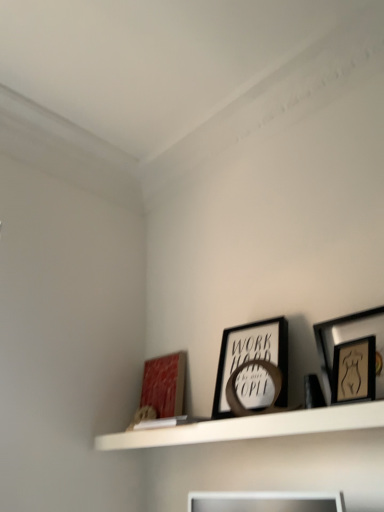
At what (x,y) coordinates should I click in order to perform the action: click on wooden framed artwork at upper right, which ranks as the 3th picture frame in left-to-right order. Please return your answer as a coordinate pair (x, y). This screenshot has width=384, height=512. Looking at the image, I should click on (352, 340).

The image size is (384, 512). What do you see at coordinates (251, 357) in the screenshot?
I see `black matte picture frame at center, which is the second picture frame from front to back` at bounding box center [251, 357].

You are a GUI agent. You are given a task and a screenshot of the screen. Output one action in this format:
    pyautogui.click(x=<x>, y=<y>)
    Task: Click on the wooden framed artwork at upper right, which ranks as the 3th picture frame in left-to-right order
    The height and width of the screenshot is (512, 384).
    Given the screenshot: What is the action you would take?
    pyautogui.click(x=352, y=340)

Is matte red picture frame at lower left, placed as the 3th picture frame when sorted from right to left, to the left or to the right of black matte picture frame at center, which is the second picture frame from front to back, in the image?

Based on their positions, matte red picture frame at lower left, placed as the 3th picture frame when sorted from right to left, is located to the left of black matte picture frame at center, which is the second picture frame from front to back.

From a real-world perspective, between matte red picture frame at lower left, the first picture frame viewed from the left, and black matte picture frame at center, which is the second picture frame from front to back, who is vertically lower?

From a 3D spatial view, matte red picture frame at lower left, the first picture frame viewed from the left, is below.

Can you see matte red picture frame at lower left, the first picture frame positioned from the back, touching black matte picture frame at center, which is the 2th picture frame in back-to-front order?

No, matte red picture frame at lower left, the first picture frame positioned from the back, is not in contact with black matte picture frame at center, which is the 2th picture frame in back-to-front order.

Consider the image. Is matte red picture frame at lower left, the third picture frame viewed from the front, facing away from black matte picture frame at center, the second picture frame when ordered from right to left?

No, matte red picture frame at lower left, the third picture frame viewed from the front, is not facing away from black matte picture frame at center, the second picture frame when ordered from right to left.

Is white matte shelf at upper center far from matte red picture frame at lower left, placed as the 3th picture frame when sorted from right to left?

No, white matte shelf at upper center is not far from matte red picture frame at lower left, placed as the 3th picture frame when sorted from right to left.

From a real-world perspective, which object stands above the other?

matte red picture frame at lower left, placed as the 3th picture frame when sorted from right to left, is physically above.

Which of these two, white matte shelf at upper center or matte red picture frame at lower left, the first picture frame positioned from the back, is wider?

white matte shelf at upper center.

From the picture: Is black matte picture frame at center, which is the second picture frame from front to back, shorter than matte red picture frame at lower left, the first picture frame positioned from the back?

No.

In the scene shown: From a real-world perspective, does black matte picture frame at center, which is the 2th picture frame in back-to-front order, sit lower than matte red picture frame at lower left, the third picture frame viewed from the front?

No, from a real-world perspective, black matte picture frame at center, which is the 2th picture frame in back-to-front order, is not beneath matte red picture frame at lower left, the third picture frame viewed from the front.

Starting from the matte red picture frame at lower left, the third picture frame viewed from the front, which picture frame is the 1st one to the right? Please provide its 2D coordinates.

[(251, 357)]

Measure the distance between black matte picture frame at center, which is the 2th picture frame in back-to-front order, and matte red picture frame at lower left, the first picture frame viewed from the left.

The distance of black matte picture frame at center, which is the 2th picture frame in back-to-front order, from matte red picture frame at lower left, the first picture frame viewed from the left, is 15.96 inches.

Does point (333, 350) come behind point (373, 401)?

That is True.

Consider the image. Measure the distance between wooden framed artwork at upper right, marked as the first picture frame in a right-to-left arrangement, and white matte shelf at upper center.

They are 12.31 inches apart.

From the image's perspective, which one is positioned lower, wooden framed artwork at upper right, which ranks as the first picture frame in front-to-back order, or white matte shelf at upper center?

white matte shelf at upper center.

Does matte red picture frame at lower left, the first picture frame viewed from the left, have a smaller size compared to wooden framed artwork at upper right, which ranks as the 3th picture frame in left-to-right order?

Yes, matte red picture frame at lower left, the first picture frame viewed from the left, is smaller than wooden framed artwork at upper right, which ranks as the 3th picture frame in left-to-right order.

Is matte red picture frame at lower left, the first picture frame positioned from the back, facing towards wooden framed artwork at upper right, which ranks as the first picture frame in front-to-back order?

No, matte red picture frame at lower left, the first picture frame positioned from the back, is not facing towards wooden framed artwork at upper right, which ranks as the first picture frame in front-to-back order.

From the image's perspective, between matte red picture frame at lower left, the first picture frame positioned from the back, and wooden framed artwork at upper right, which ranks as the 3th picture frame in left-to-right order, which one is located above?

wooden framed artwork at upper right, which ranks as the 3th picture frame in left-to-right order.

Is matte red picture frame at lower left, placed as the 3th picture frame when sorted from right to left, not close to wooden framed artwork at upper right, which ranks as the 3th picture frame in left-to-right order?

matte red picture frame at lower left, placed as the 3th picture frame when sorted from right to left, is near wooden framed artwork at upper right, which ranks as the 3th picture frame in left-to-right order, not far away.

Which object is further away from the camera, white matte shelf at upper center or black matte picture frame at center, marked as the second picture frame in a left-to-right arrangement?

black matte picture frame at center, marked as the second picture frame in a left-to-right arrangement, is further away from the camera.

Is white matte shelf at upper center thinner than black matte picture frame at center, which is the second picture frame from front to back?

Incorrect, the width of white matte shelf at upper center is not less than that of black matte picture frame at center, which is the second picture frame from front to back.

Is white matte shelf at upper center next to black matte picture frame at center, marked as the second picture frame in a left-to-right arrangement?

white matte shelf at upper center is not next to black matte picture frame at center, marked as the second picture frame in a left-to-right arrangement, and they're not touching.

From a real-world perspective, which object rests below the other?

From a 3D spatial view, white matte shelf at upper center is below.

Would you say matte red picture frame at lower left, the first picture frame viewed from the left, is outside white matte shelf at upper center?

matte red picture frame at lower left, the first picture frame viewed from the left, is positioned outside white matte shelf at upper center.

Is there a large distance between matte red picture frame at lower left, the first picture frame viewed from the left, and white matte shelf at upper center?

Actually, matte red picture frame at lower left, the first picture frame viewed from the left, and white matte shelf at upper center are a little close together.

The width and height of the screenshot is (384, 512). What are the coordinates of `picture frame located on the left of white matte shelf at upper center` in the screenshot? It's located at (164, 384).

Does matte red picture frame at lower left, the first picture frame positioned from the back, turn towards white matte shelf at upper center?

No, matte red picture frame at lower left, the first picture frame positioned from the back, is not oriented towards white matte shelf at upper center.

Find the location of a particular element. The width and height of the screenshot is (384, 512). picture frame below the black matte picture frame at center, which is the 2th picture frame in back-to-front order (from the image's perspective) is located at coordinates (164, 384).

Identify the location of shelf lying in front of the matte red picture frame at lower left, the first picture frame positioned from the back. (252, 426).

Based on their spatial positions, is white matte shelf at upper center or matte red picture frame at lower left, the first picture frame positioned from the back, closer to wooden framed artwork at upper right, marked as the first picture frame in a right-to-left arrangement?

Among the two, white matte shelf at upper center is located nearer to wooden framed artwork at upper right, marked as the first picture frame in a right-to-left arrangement.

Which object lies nearer to the anchor point white matte shelf at upper center, wooden framed artwork at upper right, acting as the 3th picture frame starting from the back, or black matte picture frame at center, which is the 2th picture frame in back-to-front order?

black matte picture frame at center, which is the 2th picture frame in back-to-front order, is closer to white matte shelf at upper center.

From the image, which object appears to be farther from black matte picture frame at center, the second picture frame when ordered from right to left, white matte shelf at upper center or matte red picture frame at lower left, the first picture frame viewed from the left?

matte red picture frame at lower left, the first picture frame viewed from the left, is positioned further to the anchor black matte picture frame at center, the second picture frame when ordered from right to left.

Considering their positions, is matte red picture frame at lower left, the third picture frame viewed from the front, positioned closer to white matte shelf at upper center than wooden framed artwork at upper right, acting as the 3th picture frame starting from the back?

The object closer to white matte shelf at upper center is wooden framed artwork at upper right, acting as the 3th picture frame starting from the back.

Estimate the real-world distances between objects in this image. Which object is closer to matte red picture frame at lower left, the first picture frame viewed from the left, wooden framed artwork at upper right, marked as the first picture frame in a right-to-left arrangement, or white matte shelf at upper center?

white matte shelf at upper center lies closer to matte red picture frame at lower left, the first picture frame viewed from the left, than the other object.

When comparing their distances from wooden framed artwork at upper right, which ranks as the 3th picture frame in left-to-right order, does matte red picture frame at lower left, placed as the 3th picture frame when sorted from right to left, or white matte shelf at upper center seem further?

matte red picture frame at lower left, placed as the 3th picture frame when sorted from right to left.

From the image, which object appears to be nearer to matte red picture frame at lower left, the third picture frame viewed from the front, white matte shelf at upper center or wooden framed artwork at upper right, marked as the first picture frame in a right-to-left arrangement?

white matte shelf at upper center is closer to matte red picture frame at lower left, the third picture frame viewed from the front.

From the image, which object appears to be nearer to matte red picture frame at lower left, placed as the 3th picture frame when sorted from right to left, black matte picture frame at center, which is the second picture frame from front to back, or wooden framed artwork at upper right, marked as the first picture frame in a right-to-left arrangement?

black matte picture frame at center, which is the second picture frame from front to back, is positioned closer to the anchor matte red picture frame at lower left, placed as the 3th picture frame when sorted from right to left.

This screenshot has width=384, height=512. Identify the location of picture frame between matte red picture frame at lower left, the first picture frame viewed from the left, and wooden framed artwork at upper right, which ranks as the 3th picture frame in left-to-right order, from left to right. (251, 357).

Locate an element on the screen. picture frame between white matte shelf at upper center and wooden framed artwork at upper right, which ranks as the first picture frame in front-to-back order, from left to right is located at coordinates (251, 357).